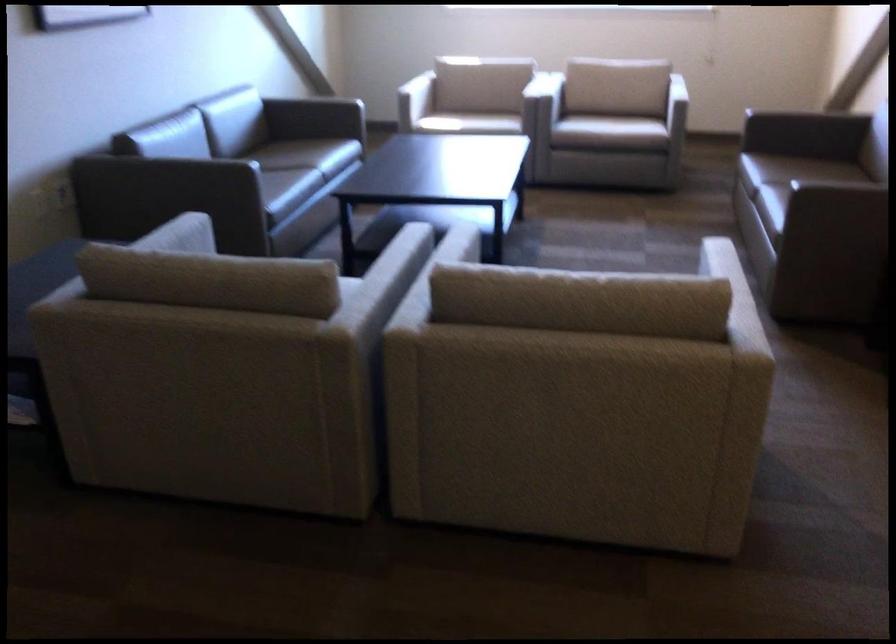
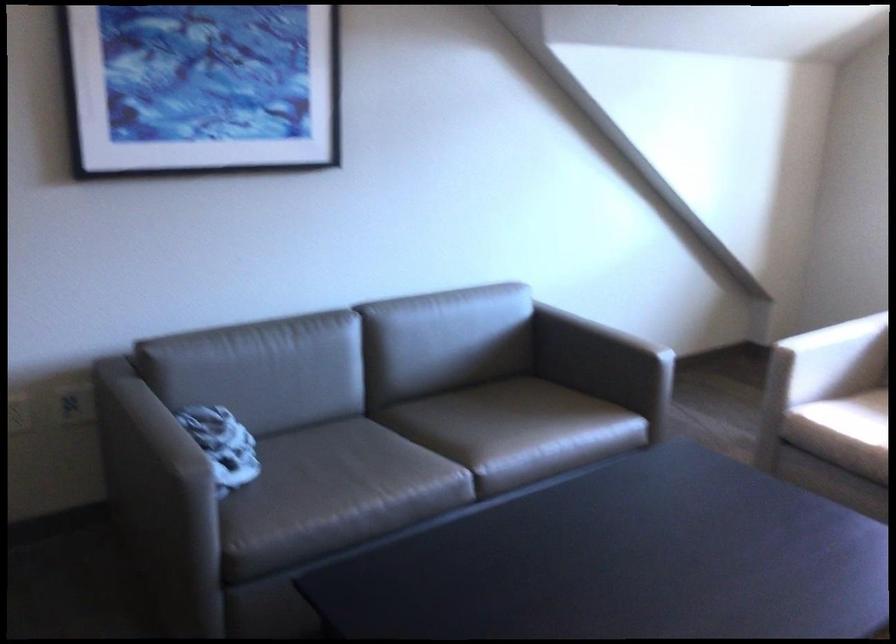
Find the pixel in the second image that matches the point at 290,147 in the first image.

(497, 430)